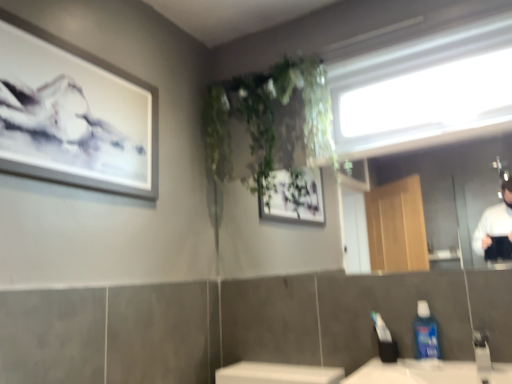
Question: Is blue glossy mouthwash at lower right at the right side of transparent glass window at upper center?

Choices:
 (A) no
 (B) yes

Answer: (A)

Question: Does blue glossy mouthwash at lower right have a larger size compared to transparent glass window at upper center?

Choices:
 (A) yes
 (B) no

Answer: (B)

Question: Does blue glossy mouthwash at lower right have a greater width compared to transparent glass window at upper center?

Choices:
 (A) no
 (B) yes

Answer: (A)

Question: Is blue glossy mouthwash at lower right beside transparent glass window at upper center?

Choices:
 (A) no
 (B) yes

Answer: (A)

Question: Is blue glossy mouthwash at lower right oriented towards transparent glass window at upper center?

Choices:
 (A) no
 (B) yes

Answer: (A)

Question: Looking at the image, does clear glass mirror at upper center seem bigger or smaller compared to blue glossy mouthwash at lower right?

Choices:
 (A) big
 (B) small

Answer: (A)

Question: Does point (463, 231) appear closer or farther from the camera than point (425, 344)?

Choices:
 (A) farther
 (B) closer

Answer: (A)

Question: In terms of height, does clear glass mirror at upper center look taller or shorter compared to blue glossy mouthwash at lower right?

Choices:
 (A) short
 (B) tall

Answer: (B)

Question: From a real-world perspective, relative to blue glossy mouthwash at lower right, is clear glass mirror at upper center vertically above or below?

Choices:
 (A) above
 (B) below

Answer: (A)

Question: From a real-world perspective, is clear glass mirror at upper center positioned above or below white matte picture frame at upper left?

Choices:
 (A) below
 (B) above

Answer: (A)

Question: Based on their positions, is clear glass mirror at upper center located to the left or right of white matte picture frame at upper left?

Choices:
 (A) right
 (B) left

Answer: (A)

Question: Is point (432, 165) closer or farther from the camera than point (152, 139)?

Choices:
 (A) farther
 (B) closer

Answer: (A)

Question: Considering the positions of clear glass mirror at upper center and white matte picture frame at upper left in the image, is clear glass mirror at upper center wider or thinner than white matte picture frame at upper left?

Choices:
 (A) wide
 (B) thin

Answer: (B)

Question: Looking at their shapes, would you say white matte picture frame at upper left is wider or thinner than clear glass mirror at upper center?

Choices:
 (A) thin
 (B) wide

Answer: (B)

Question: Looking at the image, does white matte picture frame at upper left seem bigger or smaller compared to clear glass mirror at upper center?

Choices:
 (A) small
 (B) big

Answer: (A)